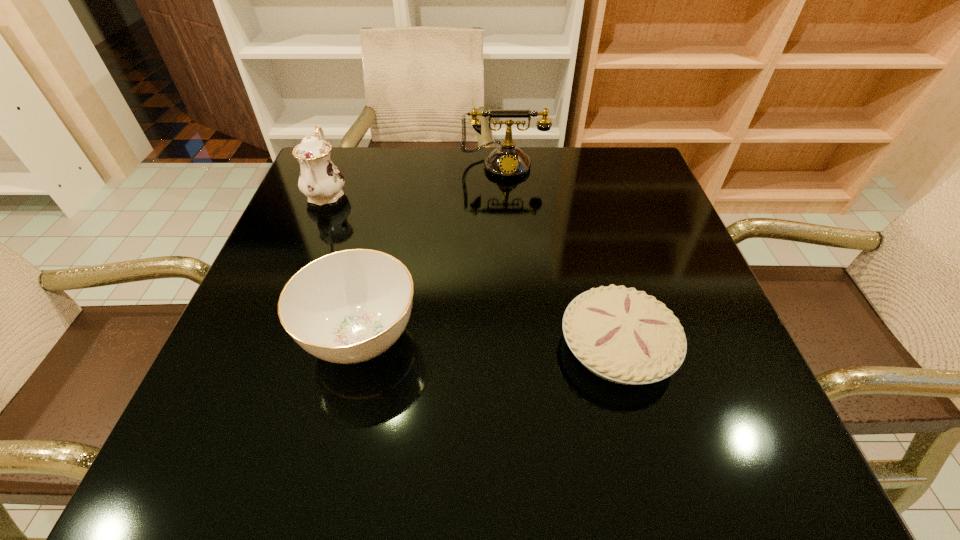
This screenshot has width=960, height=540. Find the location of `telephone located at the far edge`. telephone located at the far edge is located at coordinates (507, 161).

The image size is (960, 540). In order to click on chinaware that is at the far edge in this screenshot , I will do `click(320, 180)`.

You are a GUI agent. You are given a task and a screenshot of the screen. Output one action in this format:
    pyautogui.click(x=<x>, y=<y>)
    Task: Click on the object present at the right edge
    This screenshot has width=960, height=540.
    Given the screenshot: What is the action you would take?
    pyautogui.click(x=623, y=335)

Image resolution: width=960 pixels, height=540 pixels. I want to click on object that is at the far left corner, so click(x=320, y=180).

The width and height of the screenshot is (960, 540). Find the location of `free space at the far edge of the desktop`. free space at the far edge of the desktop is located at coordinates (443, 171).

In the image, there is a desktop. Where is `vacant space at the left edge`? This screenshot has width=960, height=540. vacant space at the left edge is located at coordinates (240, 317).

In the image, there is a desktop. Identify the location of vacant space at the right edge. (729, 357).

In the image, there is a desktop. Find the location of `blank space at the far left corner`. blank space at the far left corner is located at coordinates (367, 178).

You are a GUI agent. You are given a task and a screenshot of the screen. Output one action in this format:
    pyautogui.click(x=<x>, y=<y>)
    Task: Click on the blank area at the far right corner
    This screenshot has width=960, height=540.
    Given the screenshot: What is the action you would take?
    pyautogui.click(x=636, y=176)

Where is `free space at the near right corner of the desktop`? The width and height of the screenshot is (960, 540). free space at the near right corner of the desktop is located at coordinates (753, 432).